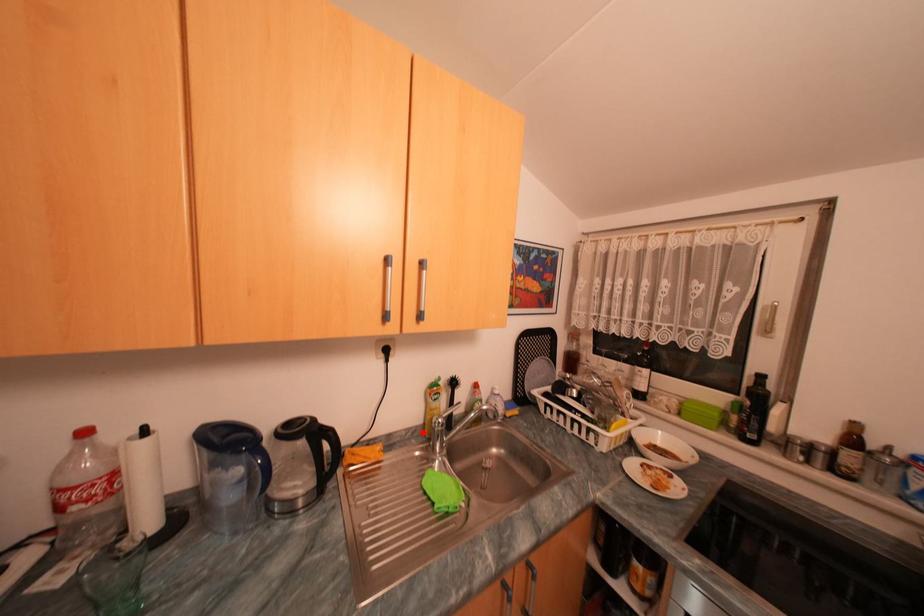
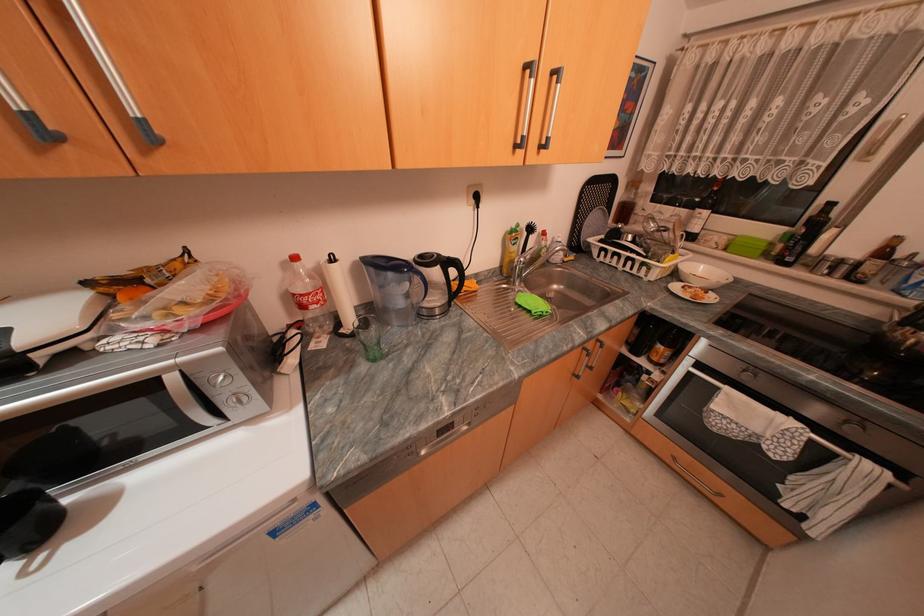
Question: I am providing you with two images of the same scene from different viewpoints. Image1 has a red point marked. In image2, the corresponding 3D location appears at what relative position? Reply with the corresponding letter.

Choices:
 (A) Closer
 (B) Farther

Answer: (A)